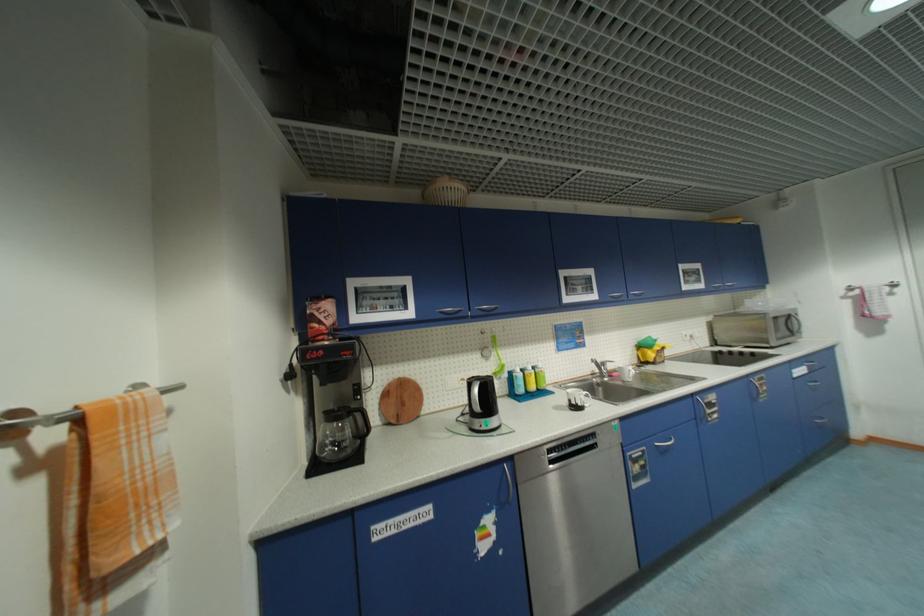
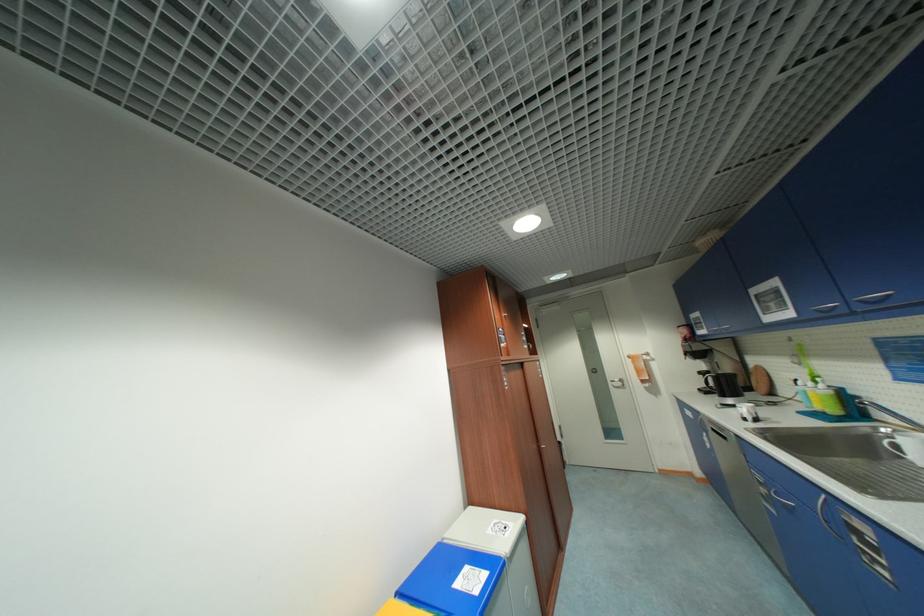
In the second image, find the point that corresponds to [616,297] in the first image.

(822, 312)